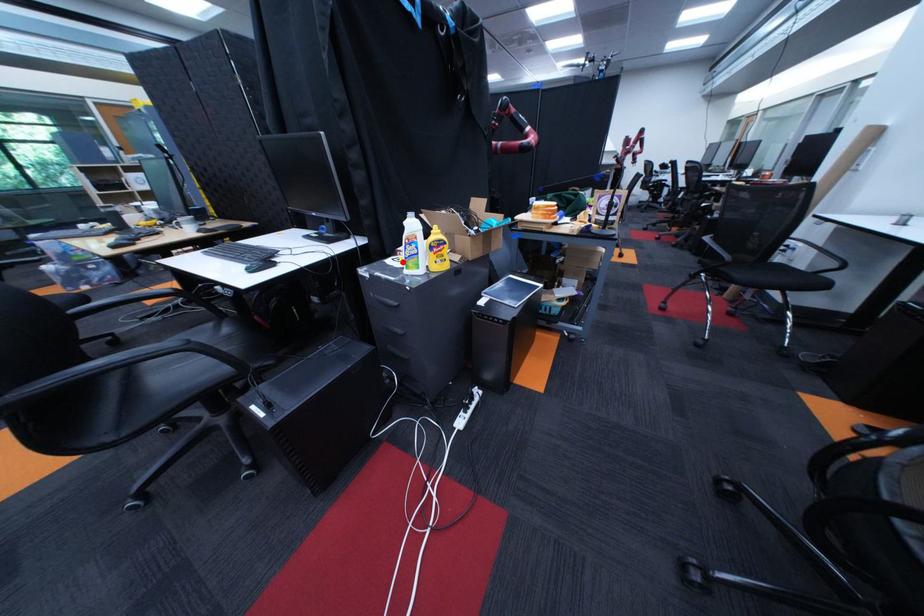
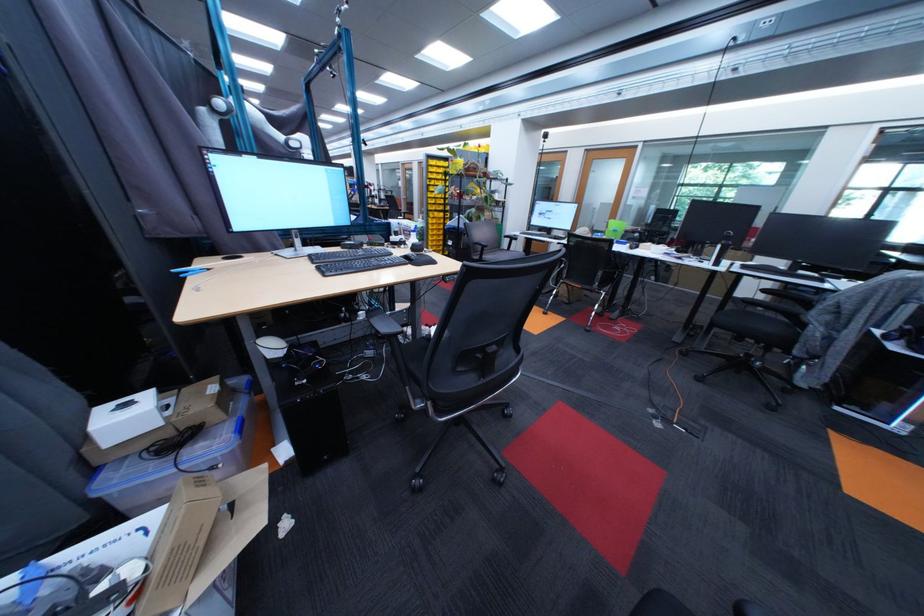
Question: I am providing you with two images of the same scene from different viewpoints. A red point is marked on the first image. Can you still see the location of the red point in image 2?

Choices:
 (A) Yes
 (B) No

Answer: (B)